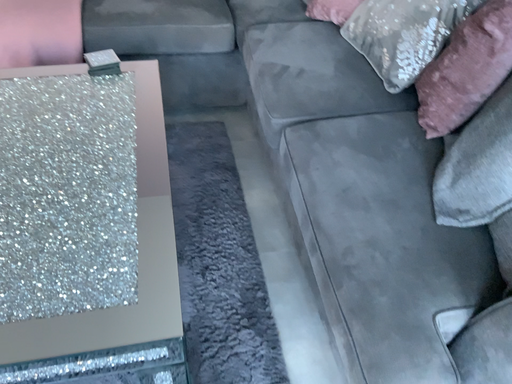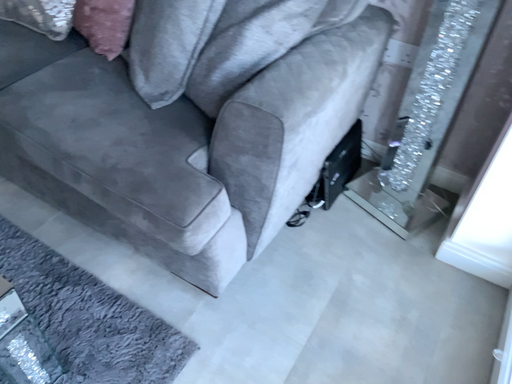
Question: Which way did the camera rotate in the video?

Choices:
 (A) rotated left
 (B) rotated right

Answer: (B)